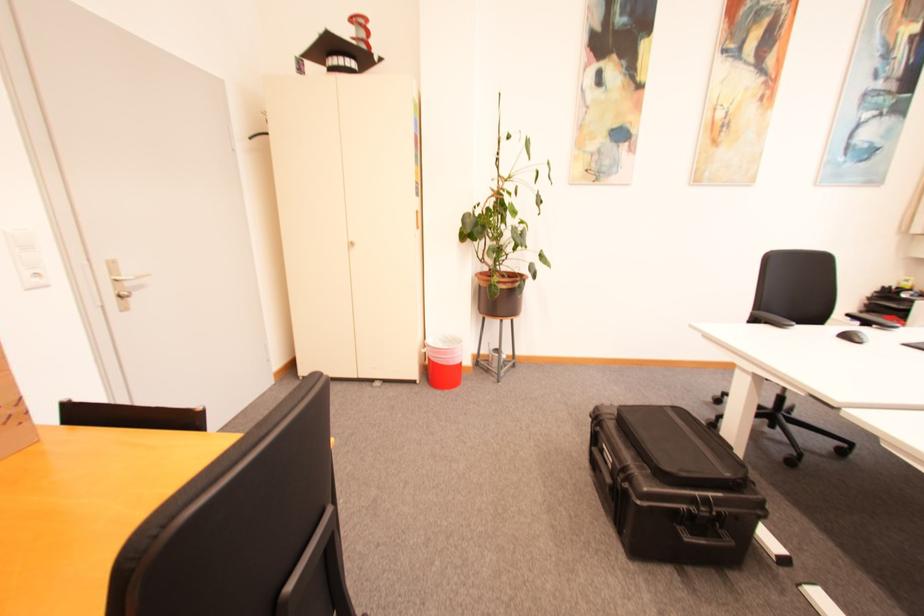
Find where to turn the silver door handle. Please return your answer as a coordinate pair (x, y).

(124, 277)